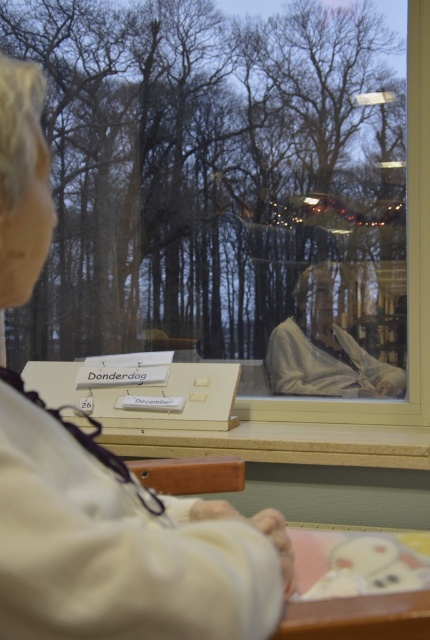
Question: Among these objects, which one is nearest to the camera?

Choices:
 (A) transparent glass window at center
 (B) white fabric at center

Answer: (A)

Question: Which object is farther from the camera taking this photo?

Choices:
 (A) white fabric at center
 (B) white fabric person at center

Answer: (A)

Question: Observing the image, what is the correct spatial positioning of transparent glass window at center in reference to white fabric person at center?

Choices:
 (A) below
 (B) above

Answer: (B)

Question: Is transparent glass window at center smaller than white fabric person at center?

Choices:
 (A) no
 (B) yes

Answer: (A)

Question: Among these points, which one is nearest to the camera?

Choices:
 (A) (208, 74)
 (B) (39, 189)

Answer: (B)

Question: In this image, where is white fabric person at center located relative to white fabric at center?

Choices:
 (A) below
 (B) above

Answer: (A)